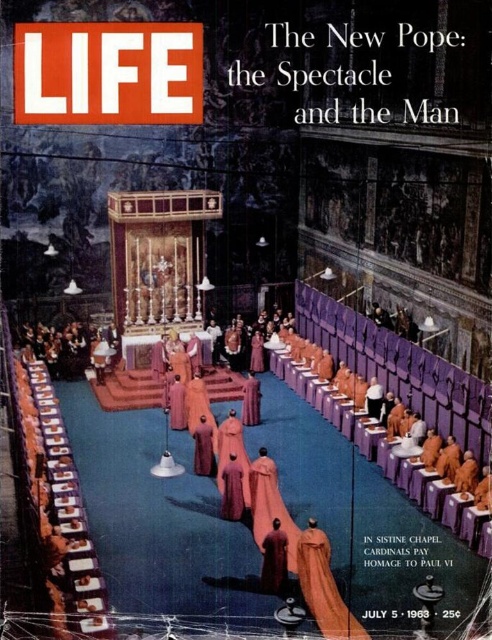
Question: Which point appears closest to the camera in this image?

Choices:
 (A) (265, 586)
 (B) (243, 500)
 (C) (214, 465)

Answer: (A)

Question: Which of the following is the closest to the observer?

Choices:
 (A) (272, 540)
 (B) (239, 506)
 (C) (203, 426)

Answer: (A)

Question: Which object appears farthest from the camera in this image?

Choices:
 (A) velvet maroon robe at center
 (B) velvet robe at center

Answer: (B)

Question: Observing the image, what is the correct spatial positioning of velvet robe at center in reference to purple velvet robe at center?

Choices:
 (A) below
 (B) above

Answer: (A)

Question: Does velvet maroon robe at center appear on the left side of velvet robe at center?

Choices:
 (A) no
 (B) yes

Answer: (A)

Question: From the image, what is the correct spatial relationship of velvet maroon robe at center in relation to purple velvet robe at center?

Choices:
 (A) right
 (B) left

Answer: (A)